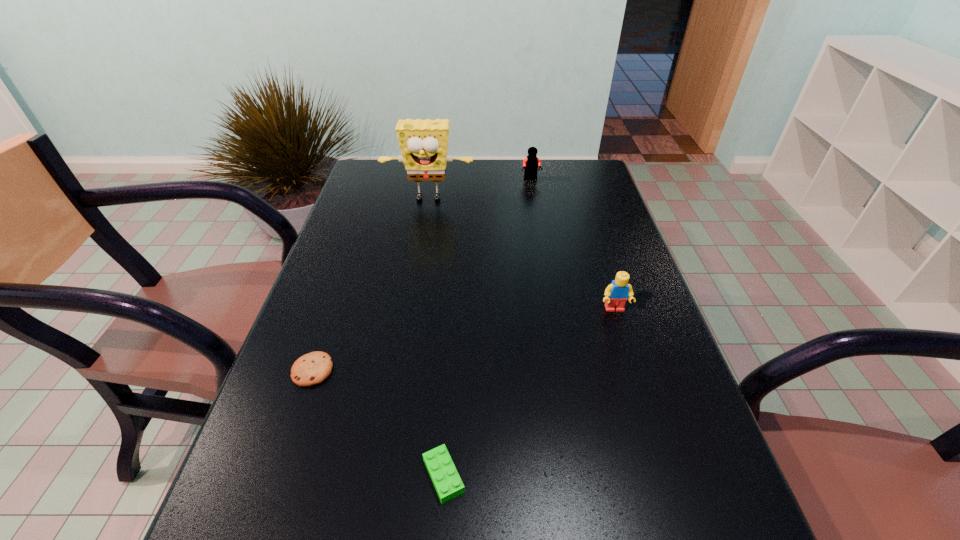
Locate an element on the screen. object that is at the far left corner is located at coordinates (423, 143).

This screenshot has height=540, width=960. I want to click on vacant space at the far edge of the desktop, so click(x=457, y=190).

I want to click on vacant space at the left edge of the desktop, so click(376, 195).

Find the location of a particular element. vacant region at the right edge of the desktop is located at coordinates (597, 335).

Locate an element on the screen. free spot at the far left corner of the desktop is located at coordinates (367, 183).

Find the location of a particular element. The width and height of the screenshot is (960, 540). vacant region between the shortest object and the farthest object is located at coordinates (421, 274).

Where is `vacant space in between the second farthest object and the third farthest object`? The image size is (960, 540). vacant space in between the second farthest object and the third farthest object is located at coordinates coord(521,255).

I want to click on blank region between the second nearest Lego and the tallest object, so click(x=521, y=255).

The height and width of the screenshot is (540, 960). Identify the location of unoccupied area between the nearest object and the cookie. (378, 423).

Identify the location of free area in between the farthest object and the third farthest object. (573, 244).